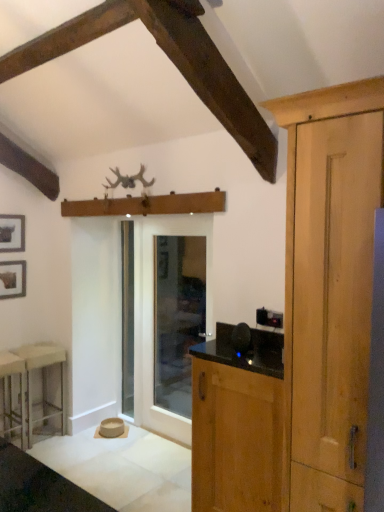
Question: Is point (218, 361) positioned closer to the camera than point (16, 231)?

Choices:
 (A) closer
 (B) farther

Answer: (A)

Question: Choose the correct answer: Is wooden cabinet at right inside matte black picture frame at upper left, which appears as the second picture frame when ordered from the bottom, or outside it?

Choices:
 (A) inside
 (B) outside

Answer: (B)

Question: Estimate the real-world distances between objects in this image. Which object is farther from the matte black picture frame at left, the 1th picture frame when ordered from bottom to top?

Choices:
 (A) matte black picture frame at upper left, which appears as the second picture frame when ordered from the bottom
 (B) clear glass door at center, the 2th screen door when ordered from left to right
 (C) clear glass screen door at center, the 1th screen door from the left
 (D) metallic silver stool at lower left, which ranks as the 1th stool in front-to-back order
 (E) wooden cabinet at right

Answer: (E)

Question: Considering the real-world distances, which object is closest to the clear glass screen door at center, the 1th screen door from the left?

Choices:
 (A) metallic silver stool at lower left, which ranks as the 1th stool in front-to-back order
 (B) white plastic stool at left, the second stool when ordered from front to back
 (C) matte black picture frame at upper left, which appears as the second picture frame when ordered from the bottom
 (D) wooden cabinet at right
 (E) clear glass door at center, the 2th screen door when ordered from left to right

Answer: (E)